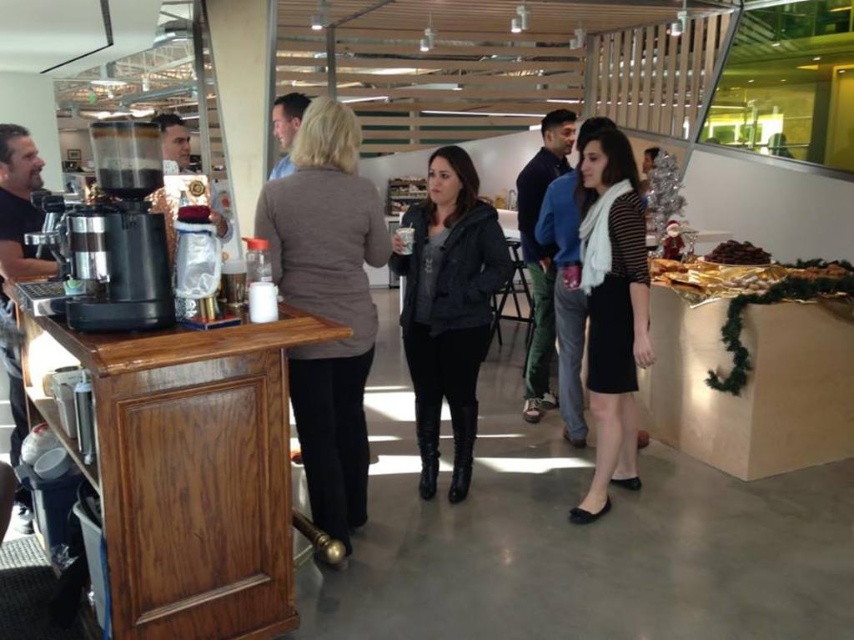
Question: Which of these objects is positioned farthest from the dark brown leather jacket at left?

Choices:
 (A) metallic silver coffee machine at left
 (B) black matte skirt at center
 (C) matte brown hair at upper center
 (D) brown woolen sweater at center

Answer: (B)

Question: Where is dark gray textured jacket at center located in relation to black matte skirt at center in the image?

Choices:
 (A) below
 (B) above

Answer: (A)

Question: Which point is closer to the camera?

Choices:
 (A) matte brown hair at upper center
 (B) dark brown leather jacket at left

Answer: (B)

Question: Is dark brown leather jacket at left wider than dark brown roasted beans at upper right?

Choices:
 (A) no
 (B) yes

Answer: (B)

Question: Which point appears closest to the camera in this image?

Choices:
 (A) (437, 419)
 (B) (98, 163)
 (C) (544, 124)
 (D) (284, 104)

Answer: (B)

Question: Can you confirm if dark brown leather jacket at left is bigger than dark brown roasted beans at upper right?

Choices:
 (A) no
 (B) yes

Answer: (B)